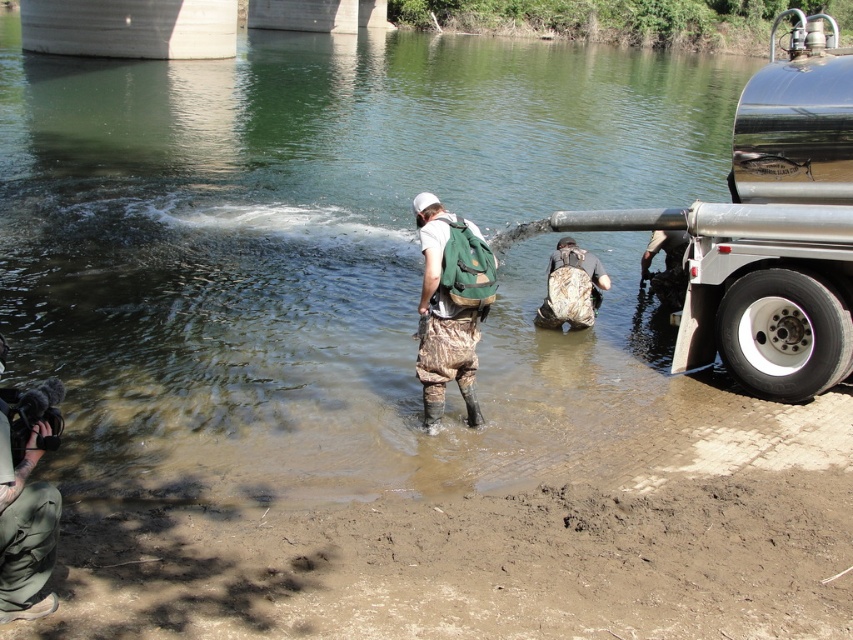
Question: Which of the following is the farthest from the observer?

Choices:
 (A) (840, 557)
 (B) (466, 371)
 (C) (834, 28)
 (D) (579, 307)

Answer: (C)

Question: Which point is farther from the camera taking this photo?

Choices:
 (A) (444, 260)
 (B) (564, 304)
 (C) (820, 156)
 (D) (90, 524)

Answer: (B)

Question: Is shiny metallic trailer truck at right positioned in front of camouflage fabric backpack at center?

Choices:
 (A) no
 (B) yes

Answer: (B)

Question: Is the position of brown muddy ground at lower left more distant than that of camouflage fabric backpack at center?

Choices:
 (A) yes
 (B) no

Answer: (B)

Question: Which point is farther from the camera taking this photo?

Choices:
 (A) click(x=167, y=572)
 (B) click(x=759, y=150)
 (C) click(x=422, y=392)

Answer: (B)

Question: Is brown muddy ground at lower left closer to the viewer compared to camouflage pants at center?

Choices:
 (A) yes
 (B) no

Answer: (A)